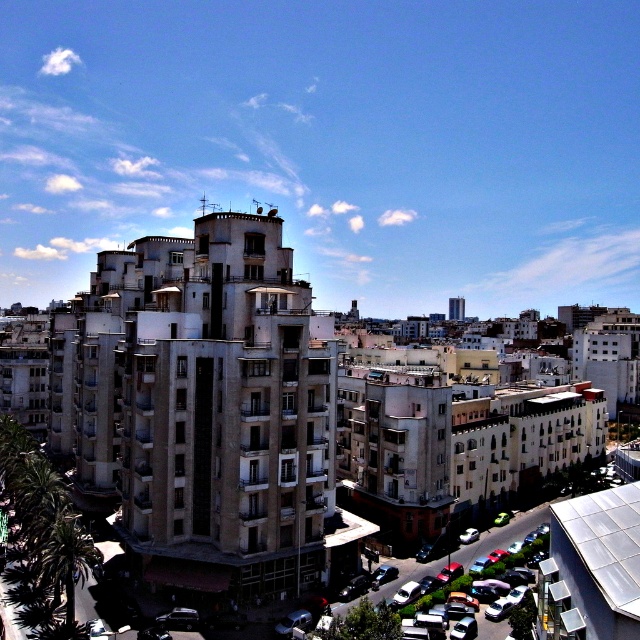
You are a pedestrian standing on the sidewalk in front of the residential building. You see the shiny silver car at lower right and the white glossy car at center. Which car is positioned more to the east side of the street?

The shiny silver car at lower right is positioned to the right of the white glossy car at center. Since the cars are on the street in front of the building, and the shiny silver car is to the right from the pedestrian perspective, it would be on the east side if the pedestrian is facing the building. However, without knowing the exact orientation of the street, we can only state that the shiny silver car at lower right is to the right of the white glossy car at center.

You are a pedestrian standing on the sidewalk and see both the shiny black car at center and the white glossy car at center. Which car is closer to the left side of the road?

The shiny black car at center is positioned on the left side of the white glossy car at center, so it is closer to the left side of the road.

Consider the image. You are a pedestrian standing at the entrance of the building. You see a shiny silver car at lower right and a shiny black car at center. Which car is parked closer to the building?

The shiny silver car at lower right is positioned under the shiny black car at center, meaning it is closer to the building.